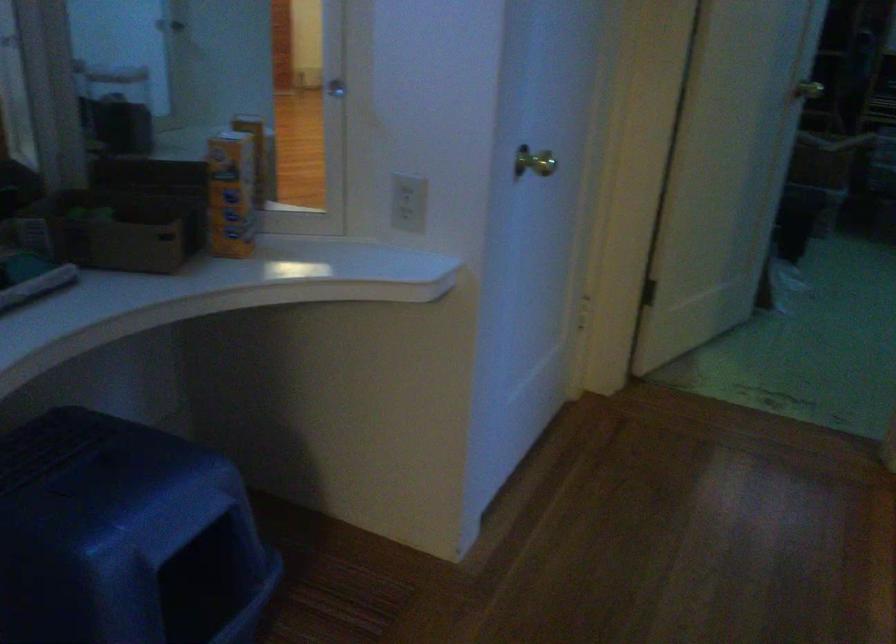
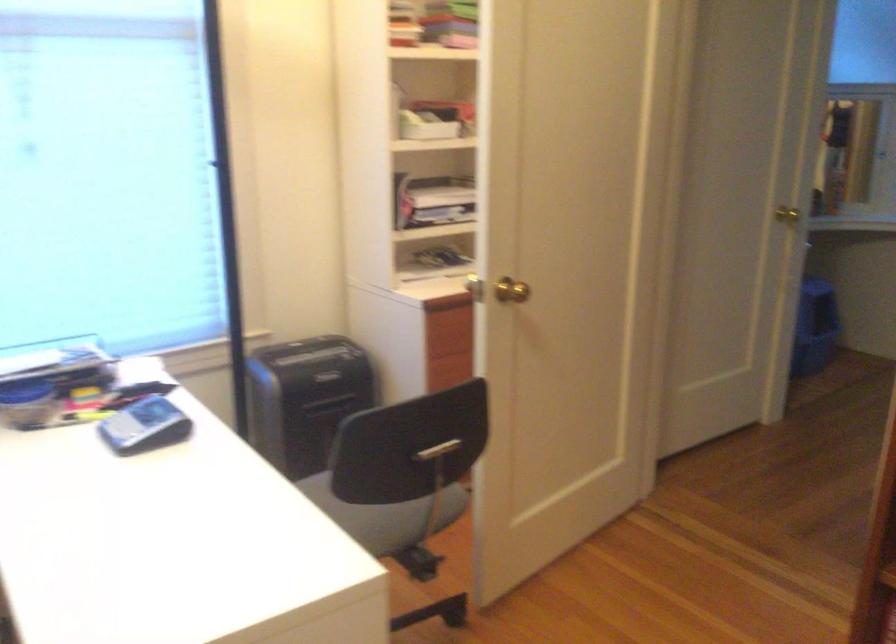
Question: I am providing you with two images of the same scene from different viewpoints. Which of the following objects are not visible in image2?

Choices:
 (A) gold door knob
 (B) brown cardboard box
 (C) chair sitting surface
 (D) cream lamp shade

Answer: (B)